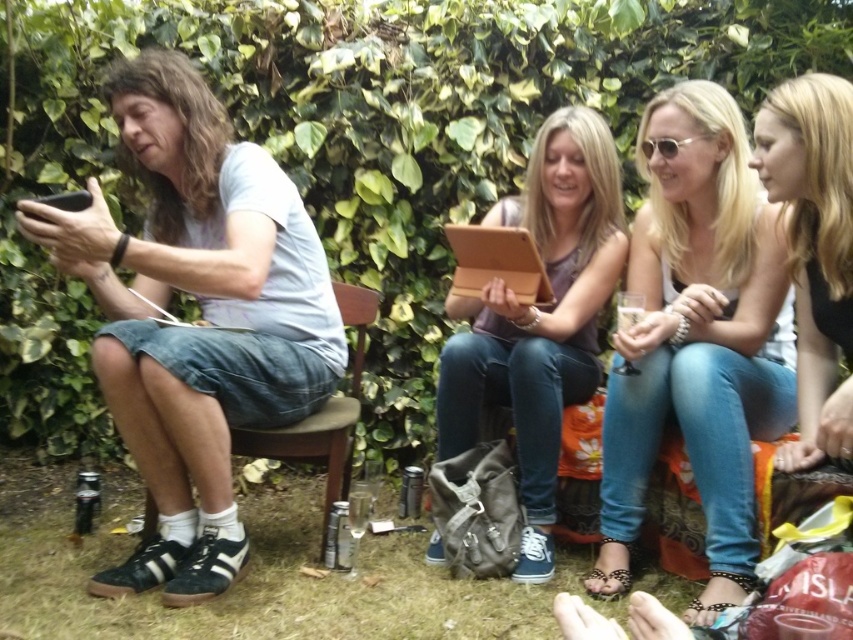
Question: Is green leafy ivy at upper center wider than green grass at lower center?

Choices:
 (A) yes
 (B) no

Answer: (A)

Question: Among these points, which one is nearest to the camera?

Choices:
 (A) (445, 452)
 (B) (169, 150)

Answer: (B)

Question: Is green leafy ivy at upper center to the right of matte white tank top at center from the viewer's perspective?

Choices:
 (A) no
 (B) yes

Answer: (A)

Question: Which of these objects is positioned closest to the green grass at lower center?

Choices:
 (A) green leafy ivy at upper center
 (B) light blue t-shirt at left
 (C) matte brown tablet at center

Answer: (B)

Question: Estimate the real-world distances between objects in this image. Which object is farther from the green leafy ivy at upper center?

Choices:
 (A) matte white tank top at center
 (B) brown wooden chair at left

Answer: (A)

Question: Can you confirm if green leafy ivy at upper center is smaller than light blue t-shirt at left?

Choices:
 (A) no
 (B) yes

Answer: (A)